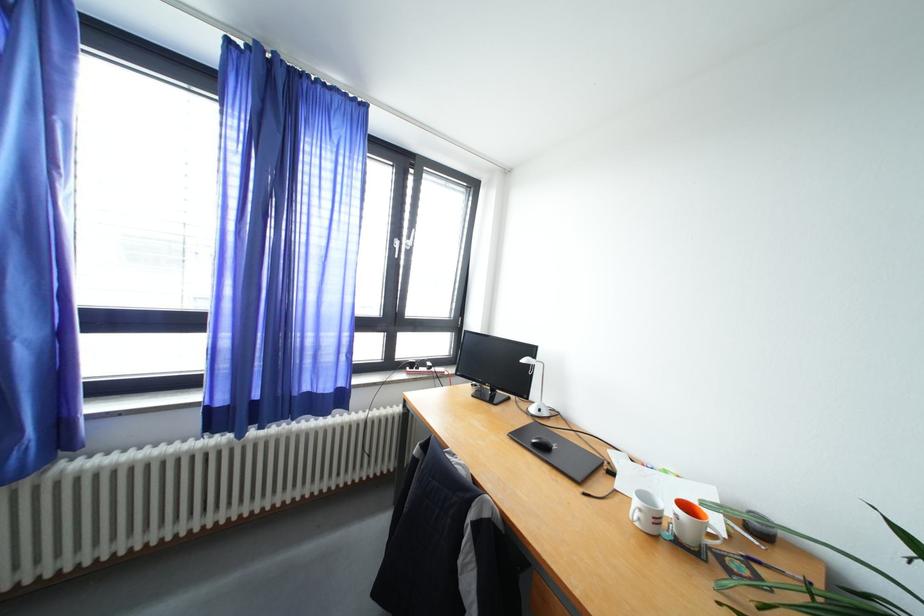
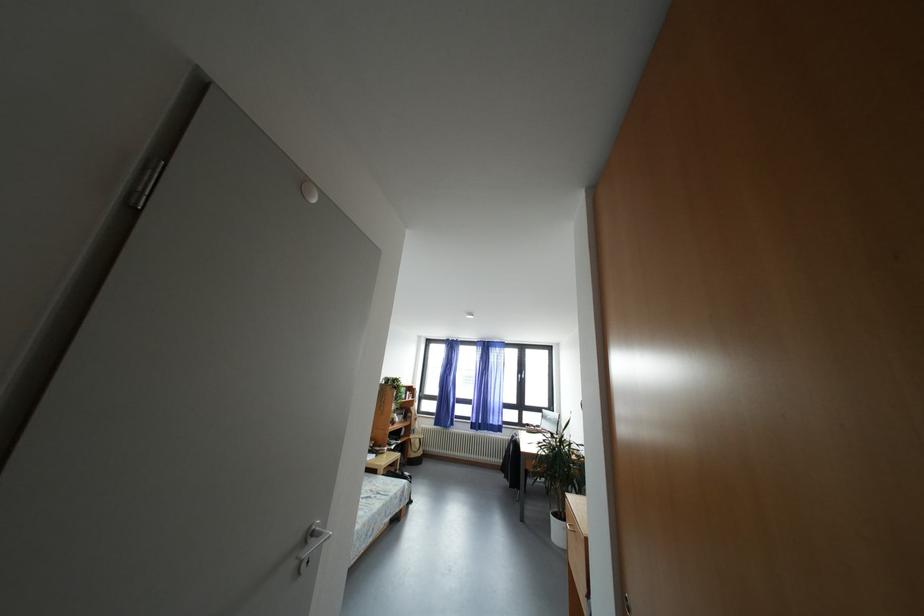
Question: I am providing you with two images of the same scene from different viewpoints. Please identify which objects are invisible in image2.

Choices:
 (A) radiator valve
 (B) chair sitting surface
 (C) orange and white mug
 (D) round light cover

Answer: (C)